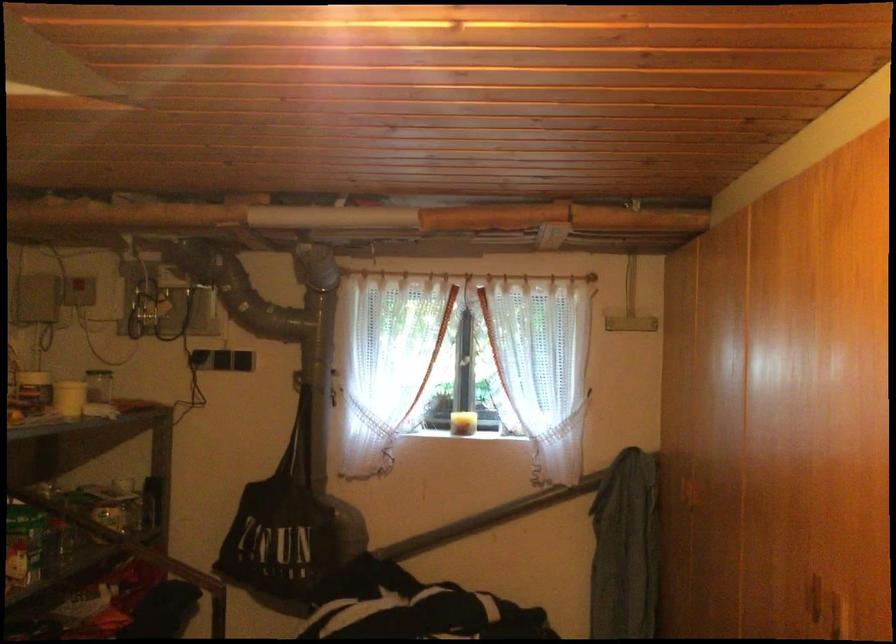
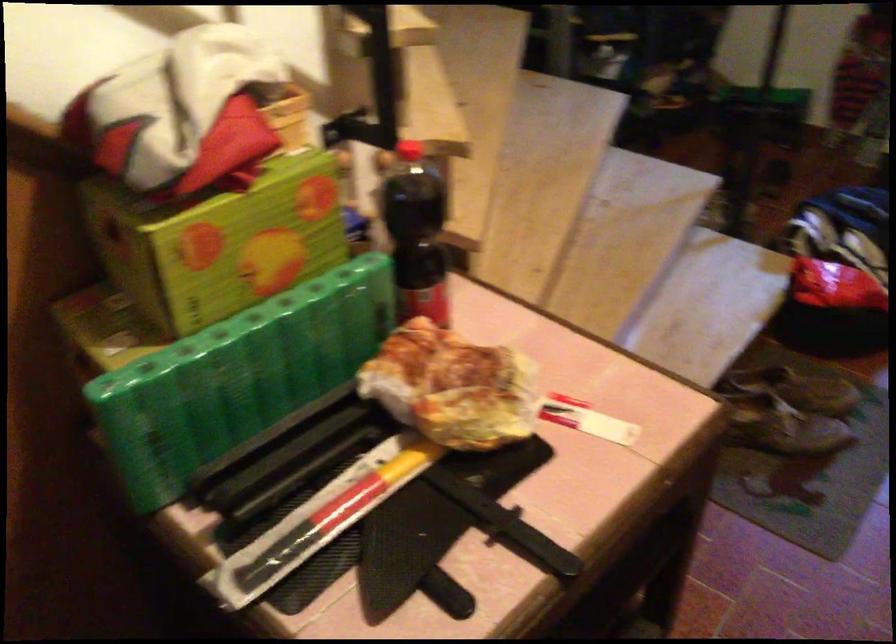
The images are taken continuously from a first-person perspective. In which direction is your viewpoint rotating?

The rotation direction of the camera is left-down.